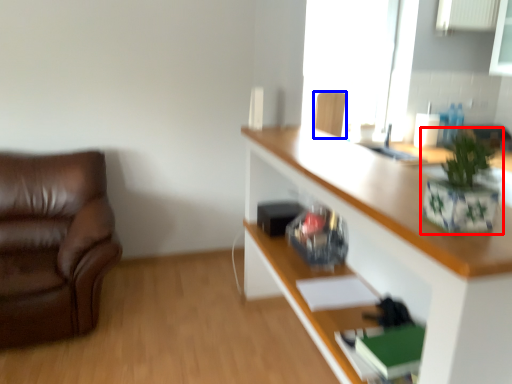
Question: Which of the following is the closest to the observer, houseplant (highlighted by a red box) or chair (highlighted by a blue box)?

Choices:
 (A) houseplant
 (B) chair

Answer: (A)